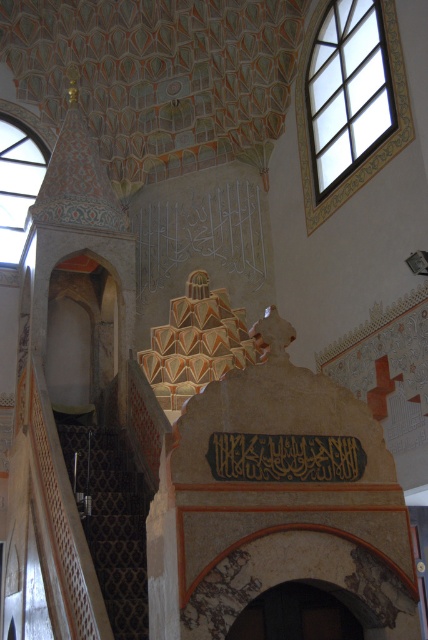
Is point (130, 570) positioned in front of point (293, 467)?

No, (130, 570) is further to viewer.

Can you confirm if dark brown carpeted stairs at lower left is positioned below black calligraphy at center?

Indeed, dark brown carpeted stairs at lower left is positioned under black calligraphy at center.

Is point (109, 436) farther from viewer compared to point (303, 468)?

That is True.

Locate an element on the screen. Image resolution: width=428 pixels, height=640 pixels. dark brown carpeted stairs at lower left is located at coordinates (112, 520).